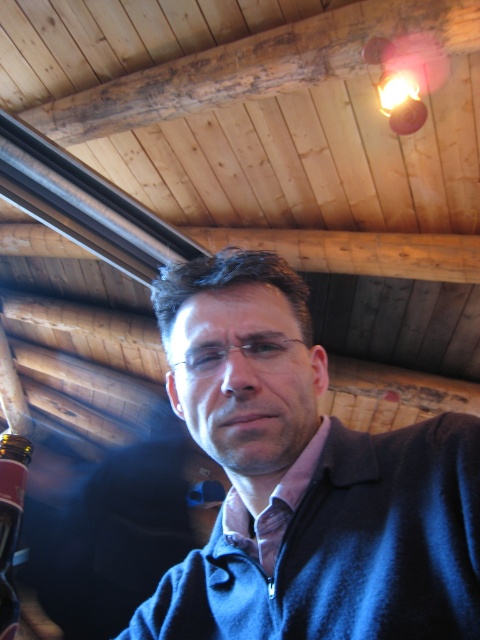
You are standing in the rustic cabin and want to place a small decoration between the two points, point [260,326] and point [19,480]. Which point should the decoration be closer to in order to be positioned in front of both?

The decoration should be closer to point [260,326] because it is in front of point [19,480] according to the spatial arrangement.